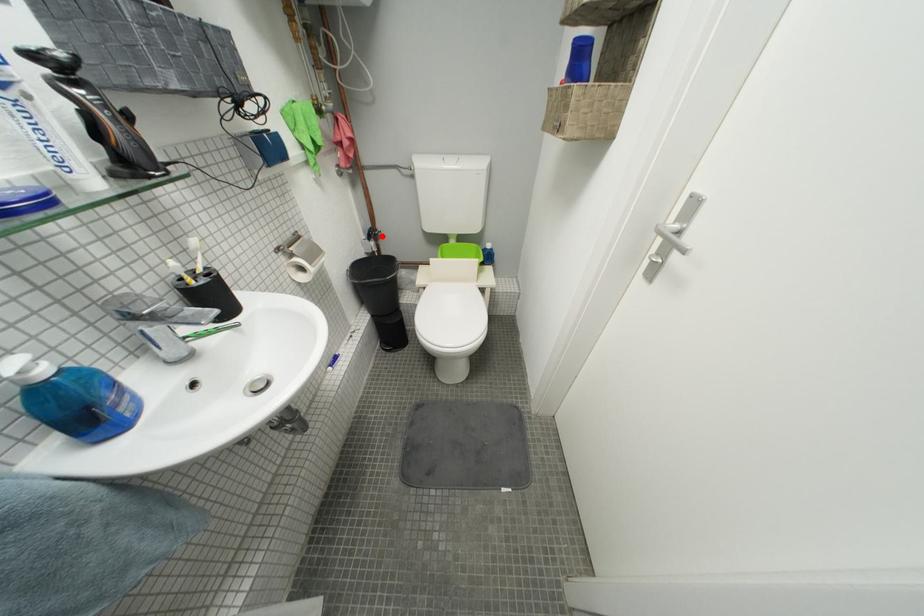
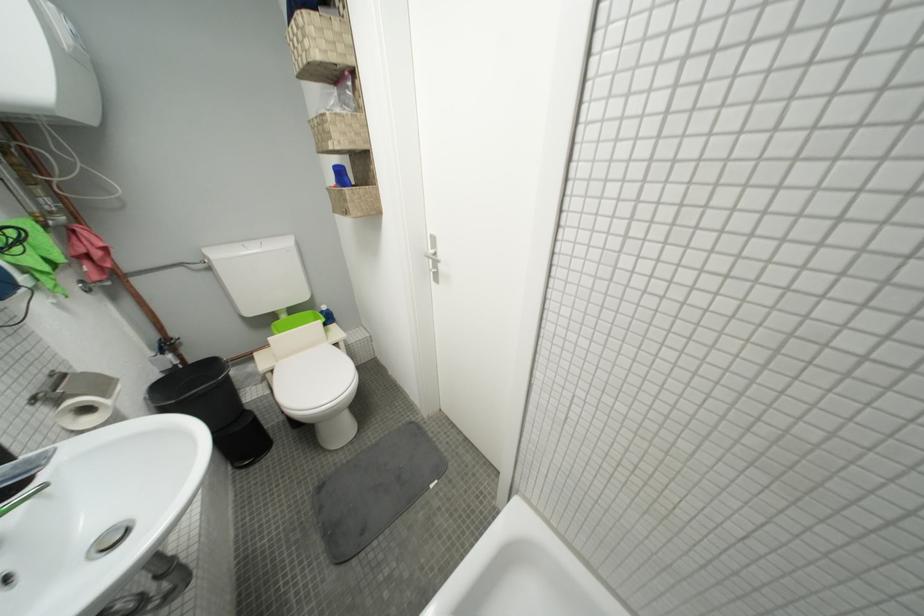
Locate, in the second image, the point that corresponds to the highlighted location in the first image.

(175, 347)